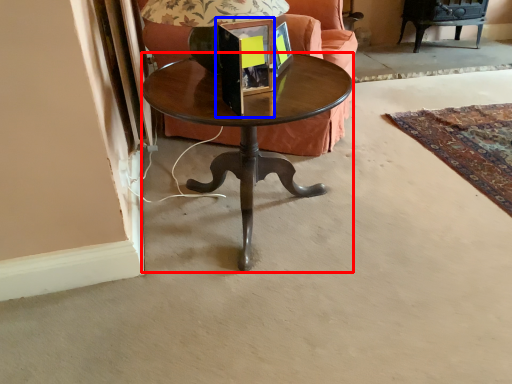
Question: Which point is closer to the camera, coffee table (highlighted by a red box) or picture frame (highlighted by a blue box)?

Choices:
 (A) coffee table
 (B) picture frame

Answer: (B)